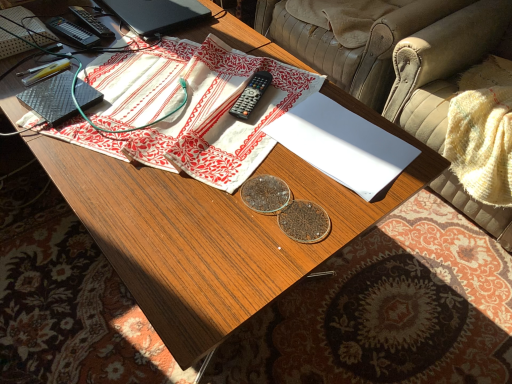
This screenshot has height=384, width=512. I want to click on vacant space underneath black matte laptop at upper left (from a real-world perspective), so (x=158, y=11).